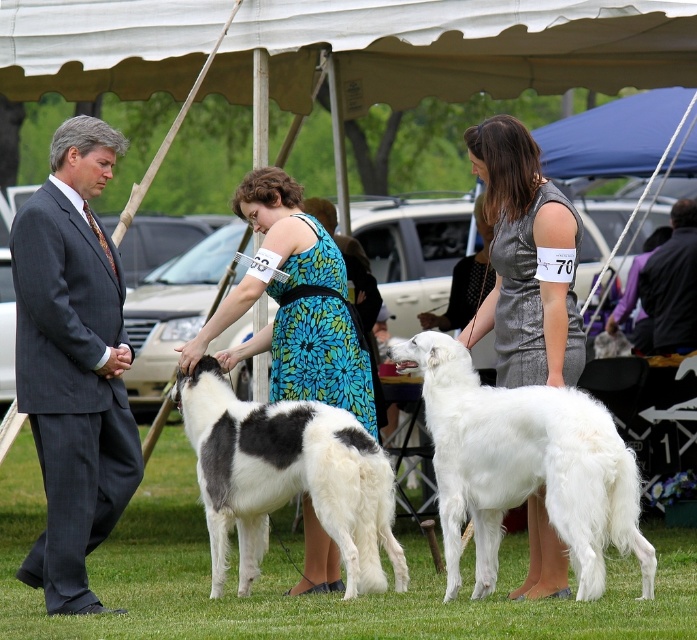
Question: Which of these objects is positioned closest to the satin silver dress at center?

Choices:
 (A) black leather jacket at lower right
 (B) blue fabric canopy at upper center
 (C) black and white fur at center
 (D) white fluffy dog at center

Answer: (D)

Question: Can you confirm if white canvas canopy at upper center is positioned above blue fabric canopy at upper center?

Choices:
 (A) no
 (B) yes

Answer: (A)

Question: Observing the image, what is the correct spatial positioning of gray pinstripe suit at left in reference to blue fabric canopy at upper center?

Choices:
 (A) left
 (B) right

Answer: (A)

Question: Considering the real-world distances, which object is farthest from the blue fabric canopy at upper center?

Choices:
 (A) satin silver dress at center
 (B) white fluffy dog at center

Answer: (B)

Question: Which point is closer to the camera taking this photo?

Choices:
 (A) (604, 122)
 (B) (107, 436)
 (C) (473, 321)

Answer: (C)

Question: Is blue fabric canopy at upper center below black leather jacket at lower right?

Choices:
 (A) yes
 (B) no

Answer: (B)